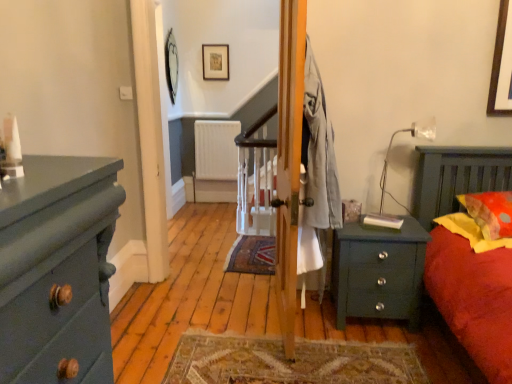
Question: From a real-world perspective, is metallic silver lamp at right positioned over metallic mirror at upper center, which is the second picture frame from right to left, based on gravity?

Choices:
 (A) yes
 (B) no

Answer: (B)

Question: Is metallic silver lamp at right thinner than metallic mirror at upper center, the 1th picture frame when ordered from left to right?

Choices:
 (A) no
 (B) yes

Answer: (A)

Question: Is metallic silver lamp at right far away from metallic mirror at upper center, the 1th picture frame when ordered from left to right?

Choices:
 (A) no
 (B) yes

Answer: (B)

Question: Is metallic silver lamp at right looking in the opposite direction of metallic mirror at upper center, the 1th picture frame when ordered from left to right?

Choices:
 (A) yes
 (B) no

Answer: (B)

Question: From the image's perspective, does metallic silver lamp at right appear lower than metallic mirror at upper center, the 1th picture frame when ordered from left to right?

Choices:
 (A) no
 (B) yes

Answer: (B)

Question: Is metallic silver lamp at right located outside metallic mirror at upper center, which is the second picture frame from right to left?

Choices:
 (A) yes
 (B) no

Answer: (A)

Question: Is matte dark green dresser at left thinner than orange dotted fabric pillow at right, which ranks as the 2th pillow in bottom-to-top order?

Choices:
 (A) yes
 (B) no

Answer: (B)

Question: From the image's perspective, is matte dark green dresser at left over orange dotted fabric pillow at right, the first pillow when ordered from top to bottom?

Choices:
 (A) yes
 (B) no

Answer: (B)

Question: From a real-world perspective, does matte dark green dresser at left stand above orange dotted fabric pillow at right, which ranks as the 2th pillow in bottom-to-top order?

Choices:
 (A) no
 (B) yes

Answer: (B)

Question: Is matte dark green dresser at left surrounding orange dotted fabric pillow at right, the first pillow when ordered from top to bottom?

Choices:
 (A) yes
 (B) no

Answer: (B)

Question: Is matte dark green dresser at left positioned in front of orange dotted fabric pillow at right, the first pillow when ordered from top to bottom?

Choices:
 (A) no
 (B) yes

Answer: (B)

Question: Can you confirm if matte dark green dresser at left is bigger than orange dotted fabric pillow at right, which ranks as the 2th pillow in bottom-to-top order?

Choices:
 (A) no
 (B) yes

Answer: (B)

Question: Is wooden picture frame at upper center, placed as the second picture frame when sorted from left to right, at the right side of yellow fabric pillow at right, which is counted as the second pillow, starting from the top?

Choices:
 (A) yes
 (B) no

Answer: (B)